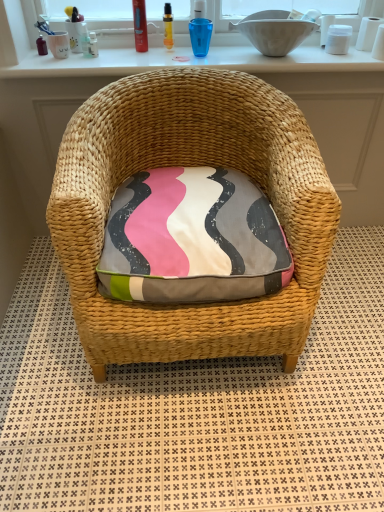
I want to click on blank space situated above natural woven chair at center (from a real-world perspective), so tap(259, 76).